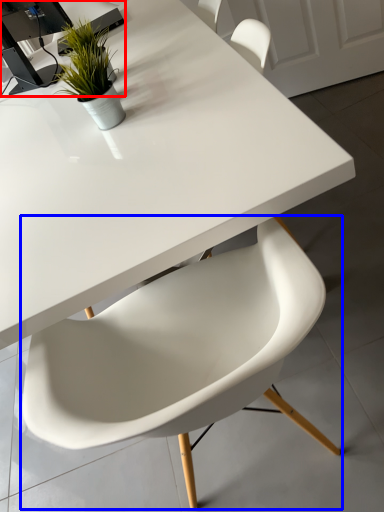
Question: Which of the following is the closest to the observer, computer desk (highlighted by a red box) or chair (highlighted by a blue box)?

Choices:
 (A) computer desk
 (B) chair

Answer: (B)